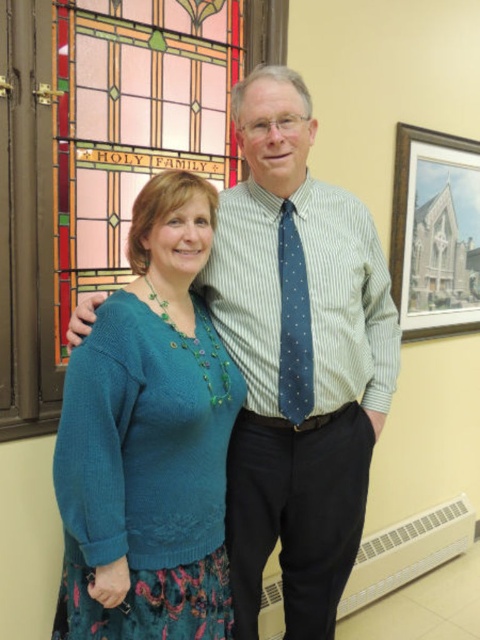
Question: Which object is the closest to the blue dotted tie at center?

Choices:
 (A) teal knitted sweater at center
 (B) wooden framed print at upper right
 (C) striped cotton shirt at center

Answer: (C)

Question: Based on their relative distances, which object is nearer to the blue dotted tie at center?

Choices:
 (A) striped cotton shirt at center
 (B) teal knitted sweater at center
 (C) wooden framed print at upper right

Answer: (A)

Question: Which of the following is the closest to the observer?

Choices:
 (A) (240, 506)
 (B) (434, 221)

Answer: (A)

Question: Can you confirm if teal knitted sweater at center is thinner than blue dotted tie at center?

Choices:
 (A) yes
 (B) no

Answer: (B)

Question: Can you confirm if striped cotton shirt at center is positioned to the left of blue dotted tie at center?

Choices:
 (A) no
 (B) yes

Answer: (A)

Question: Can you confirm if striped cotton shirt at center is positioned above blue dotted tie at center?

Choices:
 (A) yes
 (B) no

Answer: (B)